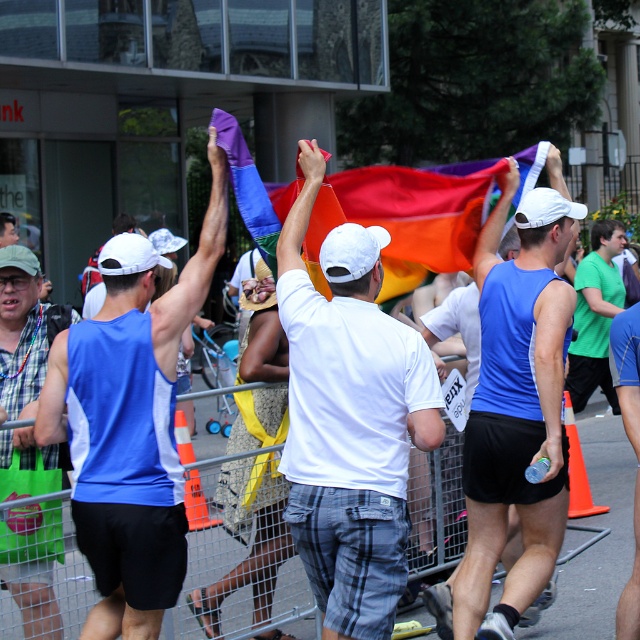
You are a photographer positioned at the back of the event. You want to capture a clear photo of the matte blue tank top at left without the blue fabric flag at center blocking it. What should you do?

The blue fabric flag at center is taller than the matte blue tank top at left, so you should lower your camera angle to avoid the flag blocking the view of the matte blue tank top at left.

You are a photographer standing behind the metal barricade. You want to take a photo that includes both the blue sleeveless shirt at center and the green matte shirt at center. What is the minimum distance you need to move backward to ensure both are fully visible in your camera frame?

The blue sleeveless shirt at center is 6.24 meters from the green matte shirt at center. To capture both in the same frame, you need to move back enough so that the distance between them fits within your camera view. However, without knowing the camera sensor size or focal length, the exact distance can not be calculated. But based on typical photography principles, moving back several meters should allow both shirts to be in frame.

You are a photographer trying to capture a clear photo of the blue sleeveless shirt at center and the green matte shirt at center during the event. Which of the two shirts should you focus on first to ensure it appears in focus if you want both in the frame?

The blue sleeveless shirt at center is taller than the green matte shirt at center. To ensure both are in focus, you should focus on the blue sleeveless shirt at center first since it is taller and likely further away, requiring a different focal plane.